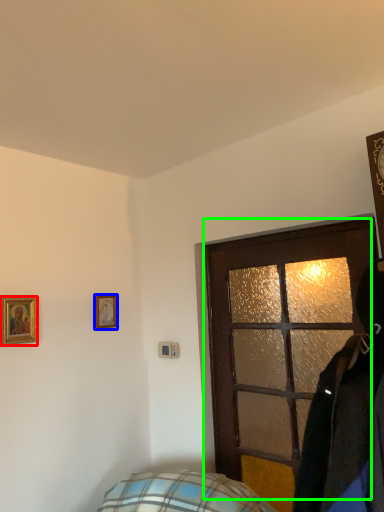
Question: Which object is positioned farthest from picture frame (highlighted by a red box)? Select from picture frame (highlighted by a blue box) and door (highlighted by a green box).

Choices:
 (A) picture frame
 (B) door

Answer: (B)